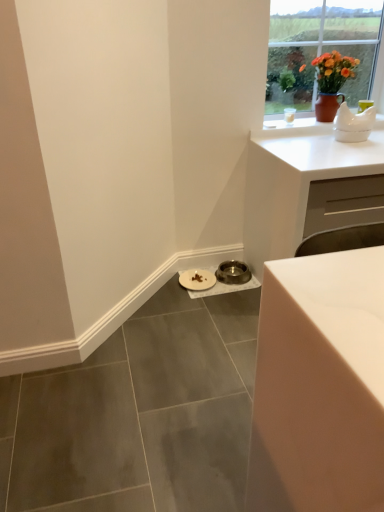
Question: Is matte brown vase at upper right positioned far away from metallic silver bowl at lower center, the second manhole cover in the left-to-right sequence?

Choices:
 (A) no
 (B) yes

Answer: (B)

Question: Is matte brown vase at upper right further to the viewer compared to metallic silver bowl at lower center, the second manhole cover in the left-to-right sequence?

Choices:
 (A) yes
 (B) no

Answer: (B)

Question: Can you confirm if matte brown vase at upper right is positioned to the right of metallic silver bowl at lower center, the second manhole cover in the left-to-right sequence?

Choices:
 (A) no
 (B) yes

Answer: (B)

Question: From the image's perspective, is matte brown vase at upper right below metallic silver bowl at lower center, which is counted as the first manhole cover, starting from the right?

Choices:
 (A) yes
 (B) no

Answer: (B)

Question: Is matte brown vase at upper right smaller than metallic silver bowl at lower center, the second manhole cover in the left-to-right sequence?

Choices:
 (A) yes
 (B) no

Answer: (B)

Question: Would you say matte brown vase at upper right contains metallic silver bowl at lower center, the second manhole cover in the left-to-right sequence?

Choices:
 (A) yes
 (B) no

Answer: (B)

Question: Can you confirm if white glossy table at lower right is smaller than matte brown vase at upper right?

Choices:
 (A) no
 (B) yes

Answer: (B)

Question: Considering the relative sizes of white glossy table at lower right and matte brown vase at upper right in the image provided, is white glossy table at lower right bigger than matte brown vase at upper right?

Choices:
 (A) no
 (B) yes

Answer: (A)

Question: Considering the relative positions of white glossy table at lower right and matte brown vase at upper right in the image provided, is white glossy table at lower right to the left of matte brown vase at upper right from the viewer's perspective?

Choices:
 (A) yes
 (B) no

Answer: (A)

Question: Does white glossy table at lower right have a greater height compared to matte brown vase at upper right?

Choices:
 (A) yes
 (B) no

Answer: (B)

Question: From a real-world perspective, is white glossy table at lower right physically below matte brown vase at upper right?

Choices:
 (A) no
 (B) yes

Answer: (B)

Question: Does white glossy table at lower right turn towards matte brown vase at upper right?

Choices:
 (A) yes
 (B) no

Answer: (B)

Question: Are metallic silver bowl at lower center, the second manhole cover in the left-to-right sequence, and white ceramic teapot at upper right making contact?

Choices:
 (A) no
 (B) yes

Answer: (A)